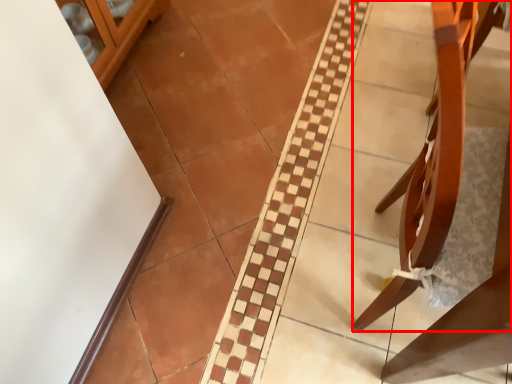
Question: From the image's perspective, where is furniture (annotated by the red box) located relative to glass door?

Choices:
 (A) below
 (B) above

Answer: (A)